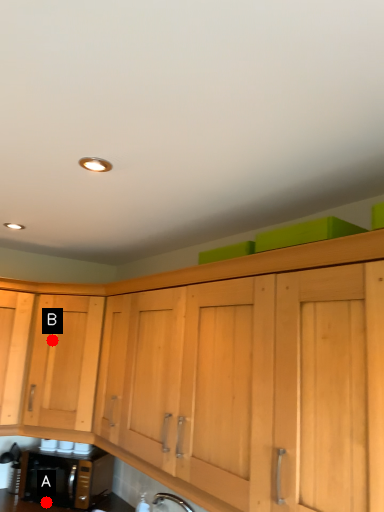
Question: Two points are circled on the image, labeled by A and B beside each circle. Which point appears farthest from the camera in this image?

Choices:
 (A) A is further
 (B) B is further

Answer: (B)